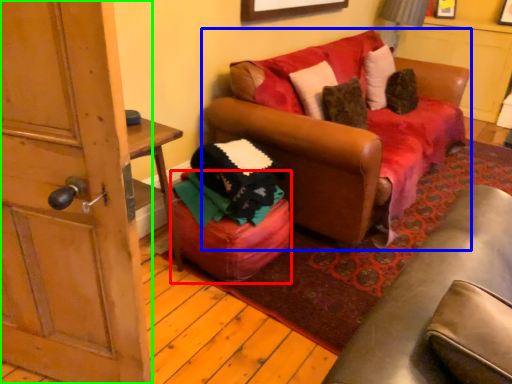
Question: Which object is the closest to the stool (highlighted by a red box)? Choose among these: studio couch (highlighted by a blue box) or door (highlighted by a green box).

Choices:
 (A) studio couch
 (B) door

Answer: (A)